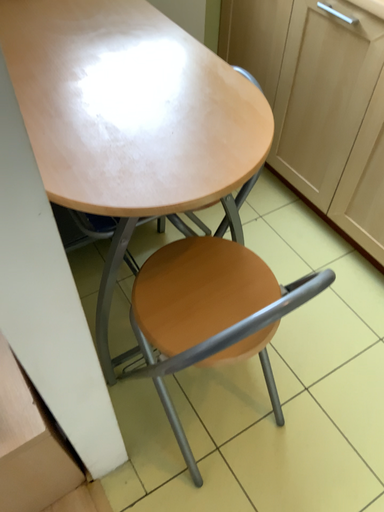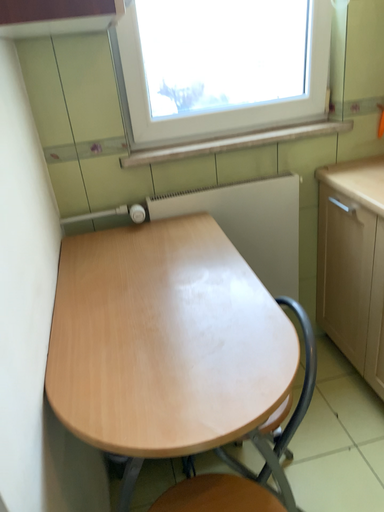
Question: How did the camera likely rotate when shooting the video?

Choices:
 (A) rotated upward
 (B) rotated downward

Answer: (A)